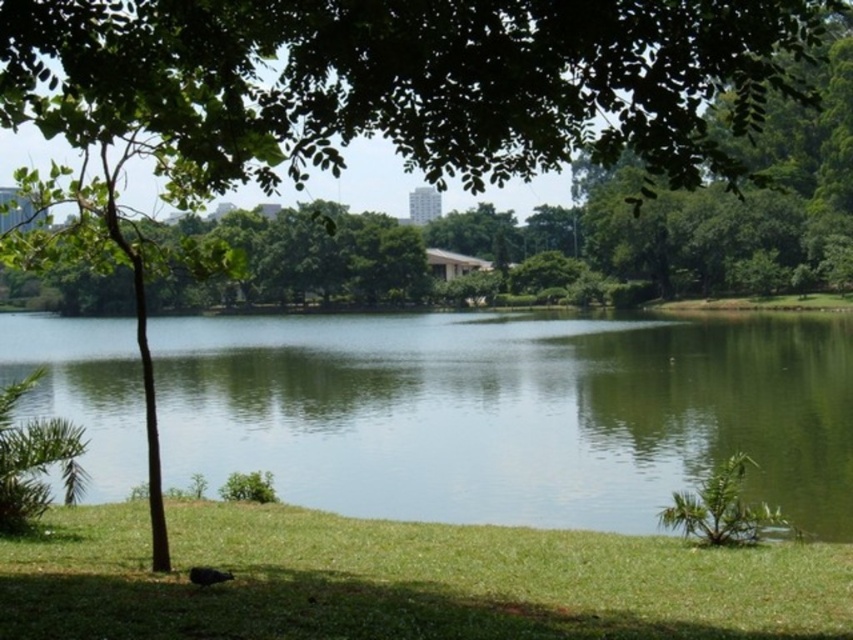
Question: Considering the relative positions of green smooth water at center and green grass at lower left in the image provided, where is green smooth water at center located with respect to green grass at lower left?

Choices:
 (A) left
 (B) right

Answer: (A)

Question: Which of the following is the farthest from the observer?

Choices:
 (A) green smooth water at center
 (B) green grass at lower left

Answer: (A)

Question: Is green smooth water at center below green grass at lower left?

Choices:
 (A) no
 (B) yes

Answer: (A)

Question: Can you confirm if green smooth water at center is wider than green grass at lower left?

Choices:
 (A) no
 (B) yes

Answer: (B)

Question: Among these objects, which one is farthest from the camera?

Choices:
 (A) green grass at lower left
 (B) green smooth water at center

Answer: (B)

Question: Which point is farther to the camera?

Choices:
 (A) (579, 586)
 (B) (334, 392)

Answer: (B)